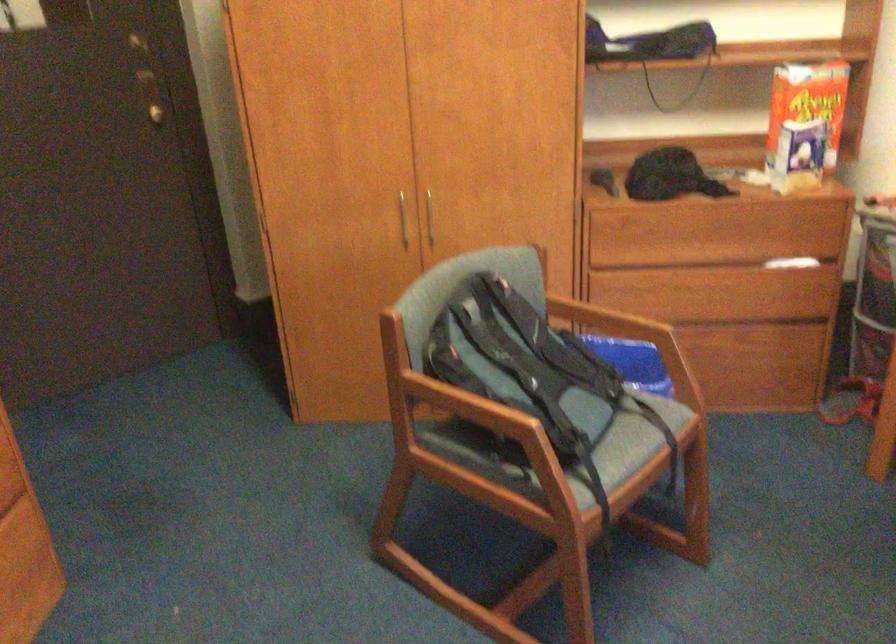
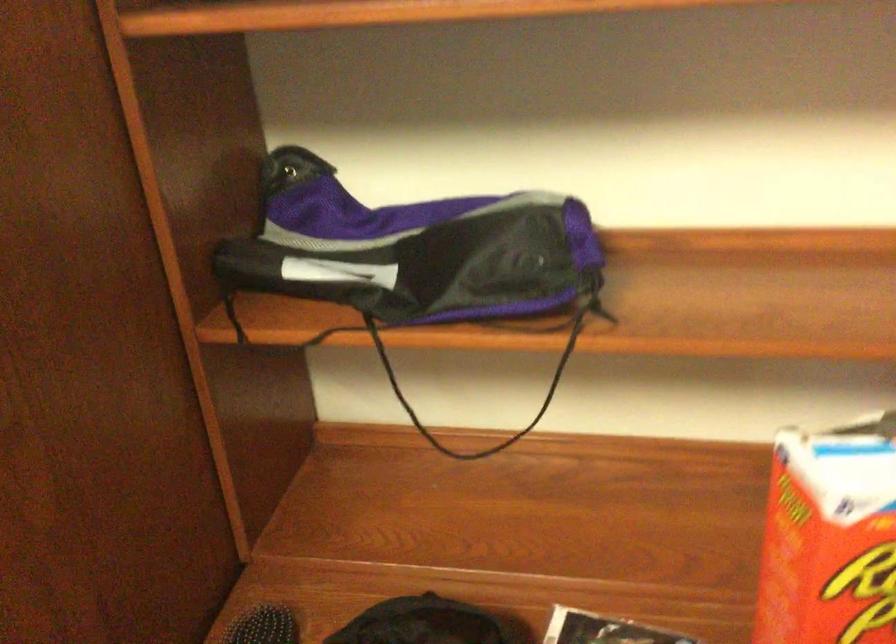
Where in the second image is the point corresponding to point 607,164 from the first image?

(263, 626)